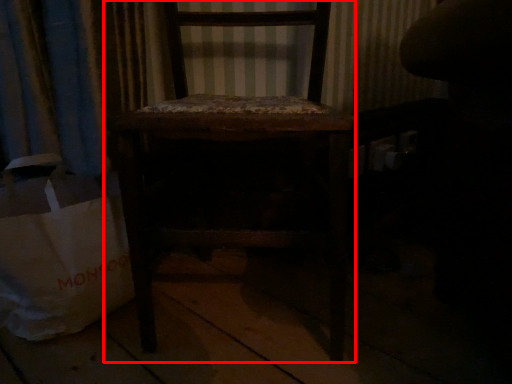
Question: Observing the image, what is the correct spatial positioning of chair (annotated by the red box) in reference to grocery bag?

Choices:
 (A) right
 (B) left

Answer: (A)